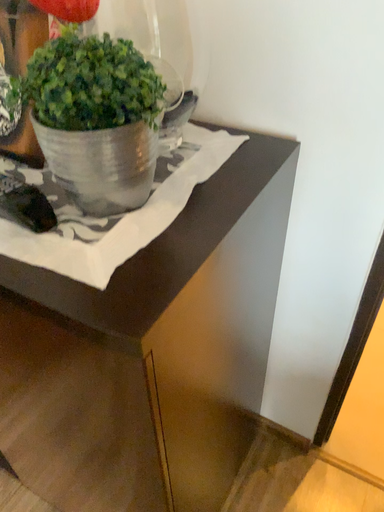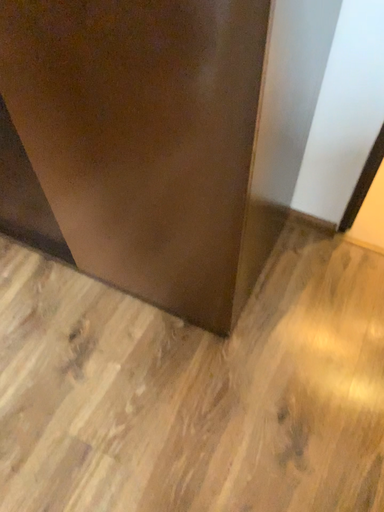
Question: Which way did the camera rotate in the video?

Choices:
 (A) rotated upward
 (B) rotated downward

Answer: (B)